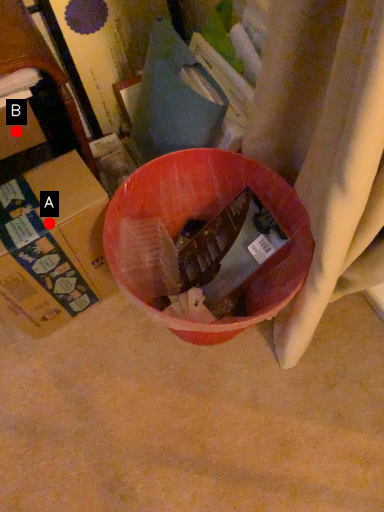
Question: Two points are circled on the image, labeled by A and B beside each circle. Which point appears farthest from the camera in this image?

Choices:
 (A) A is further
 (B) B is further

Answer: (B)